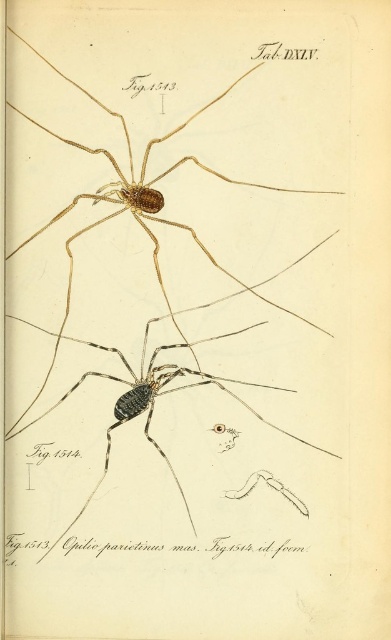
Question: Which point is farther from the camera taking this photo?

Choices:
 (A) (161, 374)
 (B) (294, 262)

Answer: (A)

Question: Does brown matte spider at upper center appear on the right side of dark brown matte spider at center?

Choices:
 (A) yes
 (B) no

Answer: (A)

Question: In this image, where is brown matte spider at upper center located relative to dark brown matte spider at center?

Choices:
 (A) above
 (B) below

Answer: (A)

Question: Is brown matte spider at upper center positioned at the back of dark brown matte spider at center?

Choices:
 (A) no
 (B) yes

Answer: (A)

Question: Which of the following is the farthest from the observer?

Choices:
 (A) (190, 522)
 (B) (120, 353)

Answer: (B)

Question: Which point is farther to the camera?

Choices:
 (A) brown matte spider at upper center
 (B) dark brown matte spider at center

Answer: (B)